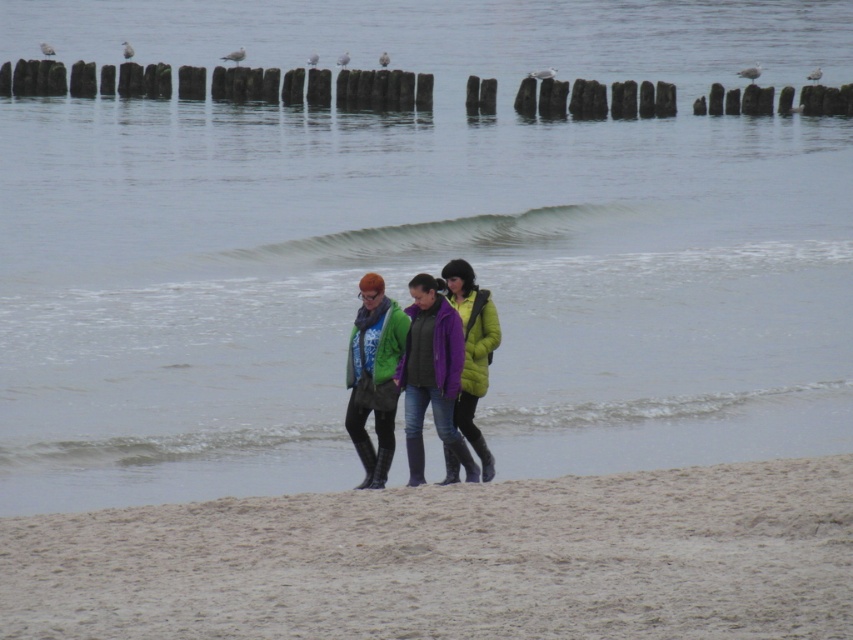
What do you see at coordinates (454, 561) in the screenshot? I see `fine-grained sand at lower center` at bounding box center [454, 561].

Which is behind, point (704, 593) or point (544, 228)?

Point (544, 228)

Identify the location of fine-grained sand at lower center. The image size is (853, 640). (454, 561).

Is smooth gray wave at center to the left of matte green jacket at center from the viewer's perspective?

In fact, smooth gray wave at center is to the right of matte green jacket at center.

Does smooth gray wave at center appear under matte green jacket at center?

No.

Is point (431, 228) closer to viewer compared to point (436, 326)?

No.

The image size is (853, 640). Identify the location of smooth gray wave at center. (436, 237).

How far apart are fine-grained sand at lower center and matte green jacket at center?

3.22 meters

Where is `fine-grained sand at lower center`? fine-grained sand at lower center is located at coordinates (454, 561).